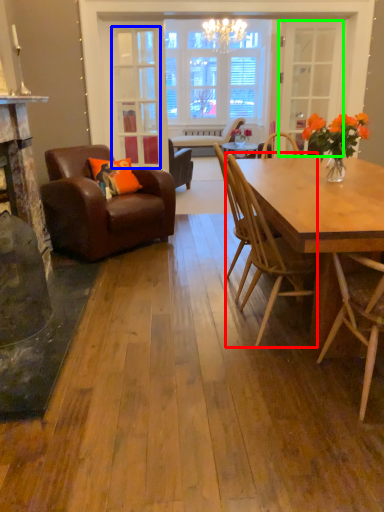
Question: Which object is positioned closest to chair (highlighted by a red box)? Select from glass door (highlighted by a blue box) and glass door (highlighted by a green box).

Choices:
 (A) glass door
 (B) glass door

Answer: (A)